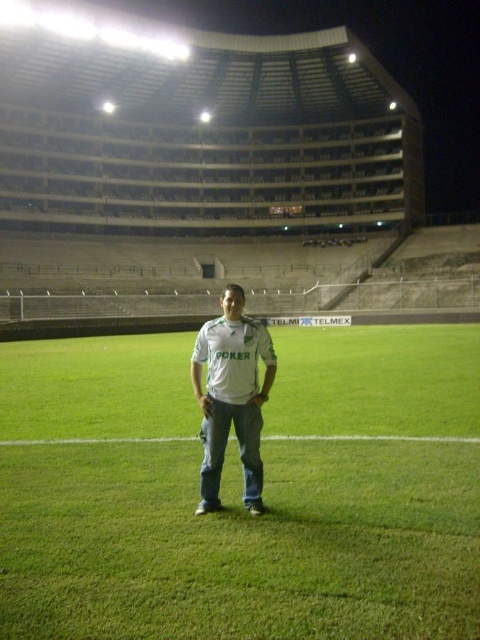
You are a photographer trying to capture the entire stadium from the field. You notice the green grass at center and the white matte shirt at center. Which object should you focus on first if you want to ensure both are in sharp focus?

The green grass at center is located below the white matte shirt at center. To ensure both are in sharp focus, focus on the white matte shirt at center since it is closer to the camera and will help set the depth of field for the foreground and background elements.

You are a photographer positioned at the edge of the stadium field. You want to take a photo that includes both the green grass at center and the white matte shirt at center. Given that your camera has a maximum focus range of 5 meters, will you be able to capture both subjects in focus?

The green grass at center is 4.22 meters away from the white matte shirt at center. Since the distance between them is within the camera maximum focus range of 5 meters, you can capture both subjects in focus.

You are a photographer trying to capture a wide shot of the stadium at night. You notice the green grass at center and the white matte shirt at center in your frame. Based on their sizes in the image, which object would appear wider in the photo?

The green grass at center appears wider in the photo because its width is larger than that of the white matte shirt at center according to the description.